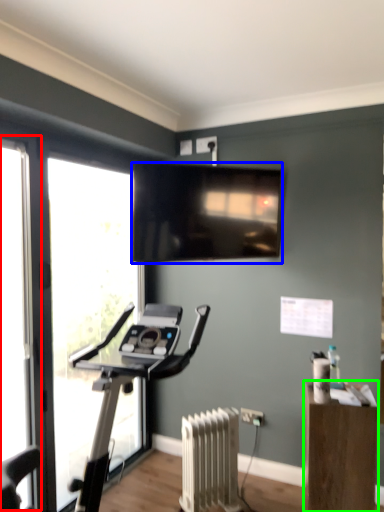
Question: Considering the real-world distances, which object is farthest from screen door (highlighted by a red box)? television (highlighted by a blue box) or furniture (highlighted by a green box)?

Choices:
 (A) television
 (B) furniture

Answer: (B)